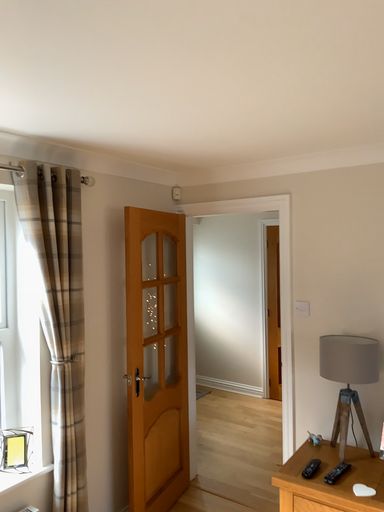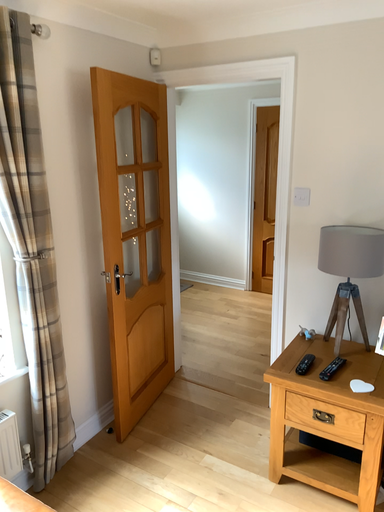
Question: Which way did the camera rotate in the video?

Choices:
 (A) rotated downward
 (B) rotated upward

Answer: (A)